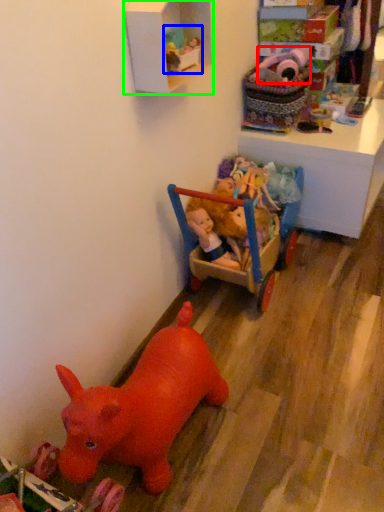
Question: Based on their relative distances, which object is nearer to toy (highlighted by a red box)? Choose from toy (highlighted by a blue box) and shelf (highlighted by a green box).

Choices:
 (A) toy
 (B) shelf

Answer: (B)